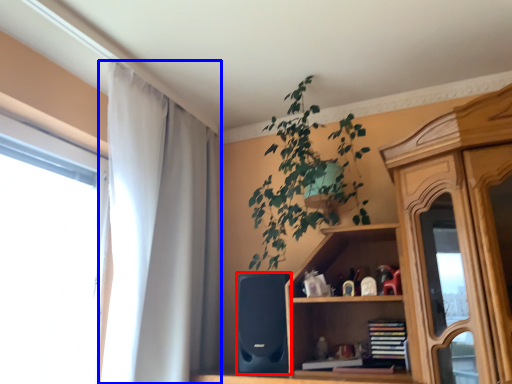
Question: Which of the following is the farthest to the observer, speaker (highlighted by a red box) or curtain (highlighted by a blue box)?

Choices:
 (A) speaker
 (B) curtain

Answer: (A)